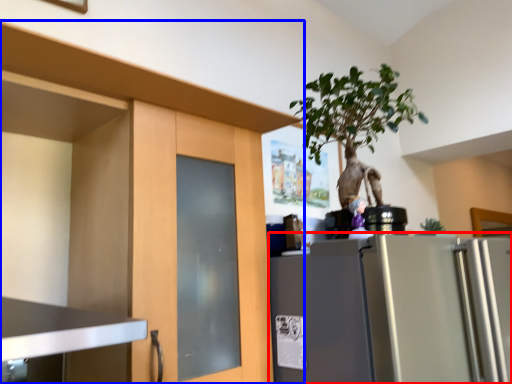
Question: Which of the following is the closest to the observer, refrigerator (highlighted by a red box) or cabinetry (highlighted by a blue box)?

Choices:
 (A) refrigerator
 (B) cabinetry

Answer: (B)